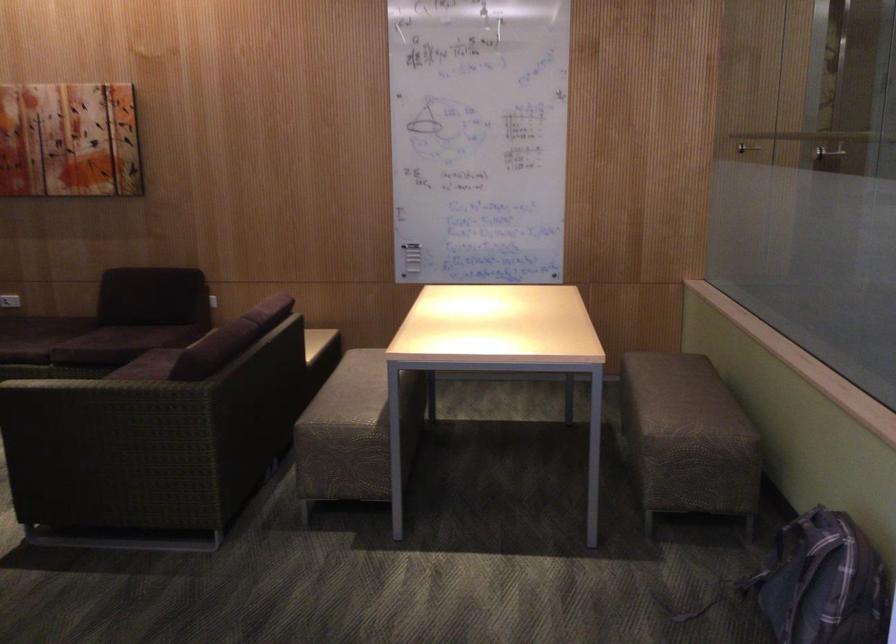
Find the location of a particular element. The height and width of the screenshot is (644, 896). metal partition handle is located at coordinates (763, 156).